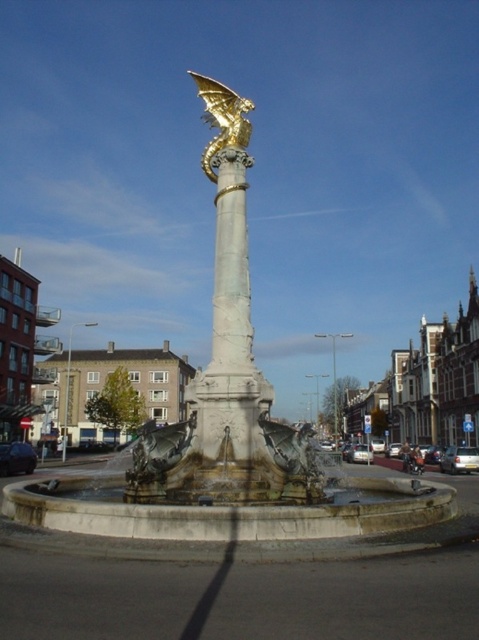
You are a city planner assessing the town square. You need to determine if the bronze fountain at center can be moved closer to the white marble column at center without overlapping. Based on their widths, can they be placed side by side in the square?

The bronze fountain at center is wider than the white marble column at center. Therefore, they can be placed side by side in the square as long as there is enough space to accommodate the combined width of both structures.

Based on the photo, you are standing in the town square and want to take a photo of both the bronze fountain at center and the white marble column at center. Which object should you focus on first to ensure both are in clear view?

You should focus on the bronze fountain at center first since it is closer to you than the white marble column at center, ensuring both are in clear view.

You are standing in the town square and want to take a photo of the white marble column at center. If your camera has a maximum zoom range of 25 meters, can you capture the entire column in one shot without moving closer?

The white marble column at center is 24.70 meters away from the camera. Since the camera can zoom up to 25 meters, it is within range to capture the entire column in one shot without moving closer.